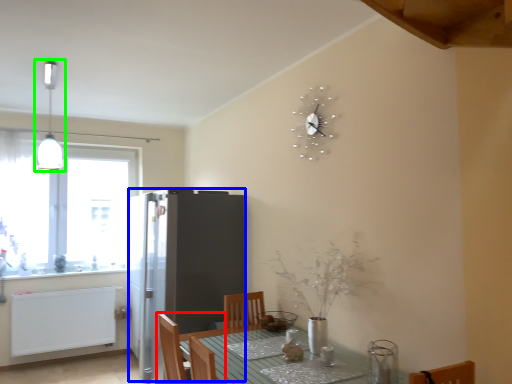
Question: Which object is the farthest from chair (highlighted by a red box)? Choose among these: fridge (highlighted by a blue box) or light fixture (highlighted by a green box).

Choices:
 (A) fridge
 (B) light fixture

Answer: (B)